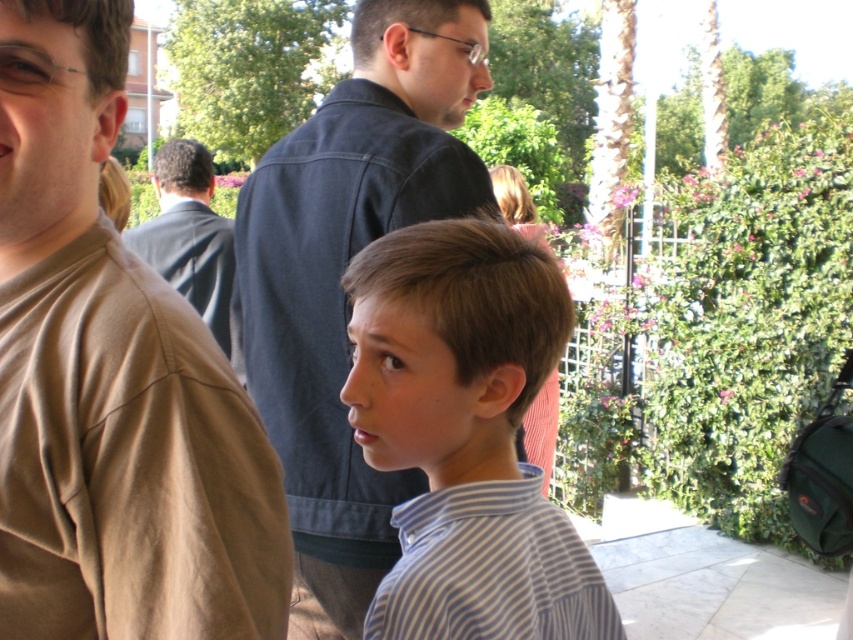
You are a photographer trying to capture a group photo of the striped cotton shirt at center and the dark blue shirt at center. Based on their heights, which one should you position closer to the camera to ensure both are fully visible in the frame?

The striped cotton shirt at center is taller than the dark blue shirt at center. To ensure both are fully visible, position the taller striped cotton shirt at center closer to the camera so its height doesn

You are standing at the camera position and want to reach the point at coordinates point (354, 445). If your walking speed is 3 feet per second, how long will it take you to reach that point?

The distance of point (354, 445) from camera is 7.38 feet. At a speed of 3 feet per second, it would take 7.38 divided by 3 equals approximately 2.46 seconds to reach the point.